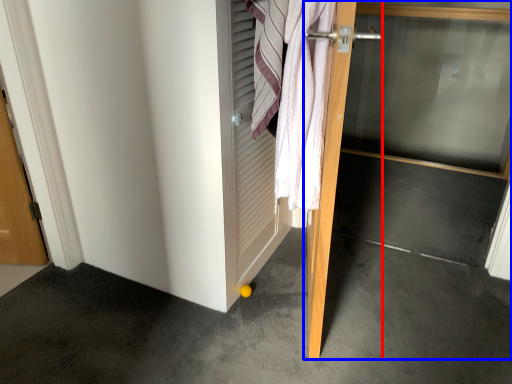
Question: Which of the following is the closest to the observer, door (highlighted by a red box) or door (highlighted by a blue box)?

Choices:
 (A) door
 (B) door

Answer: (A)